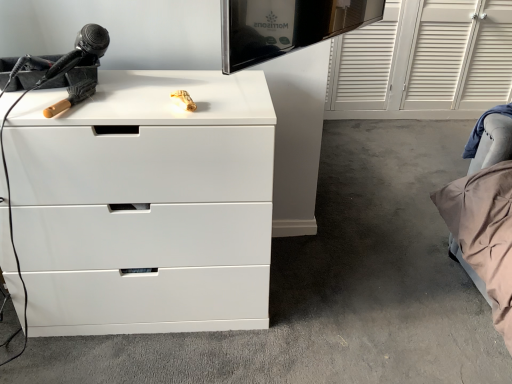
Locate an element on the screen. This screenshot has width=512, height=384. spots to the right of white glossy chest of drawers at upper left is located at coordinates (330, 295).